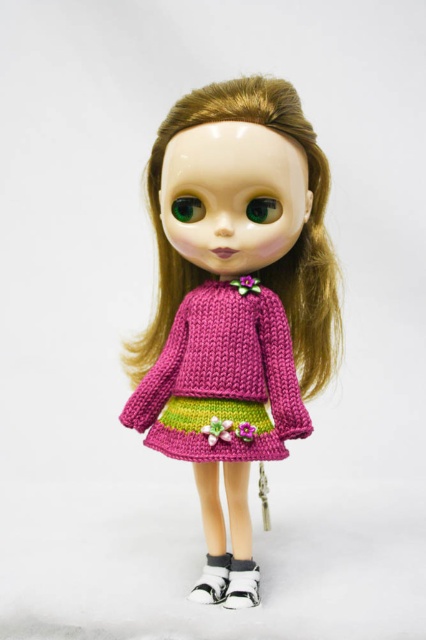
Question: Which point appears farthest from the camera in this image?

Choices:
 (A) pyautogui.click(x=261, y=296)
 (B) pyautogui.click(x=259, y=582)
 (C) pyautogui.click(x=224, y=596)

Answer: (B)

Question: Is knitted pink dress at center to the right of white fabric shoe at lower center from the viewer's perspective?

Choices:
 (A) yes
 (B) no

Answer: (B)

Question: Which of the following is the closest to the observer?

Choices:
 (A) knitted pink dress at center
 (B) white knitted socks at lower center
 (C) white fabric shoe at lower center

Answer: (A)

Question: Can you confirm if white fabric shoe at lower center is positioned to the right of white knitted socks at lower center?

Choices:
 (A) no
 (B) yes

Answer: (B)

Question: Can you confirm if knitted pink sweater at center is smaller than white knitted socks at lower center?

Choices:
 (A) no
 (B) yes

Answer: (A)

Question: Which object appears closest to the camera in this image?

Choices:
 (A) white knitted socks at lower center
 (B) white fabric shoe at lower center

Answer: (B)